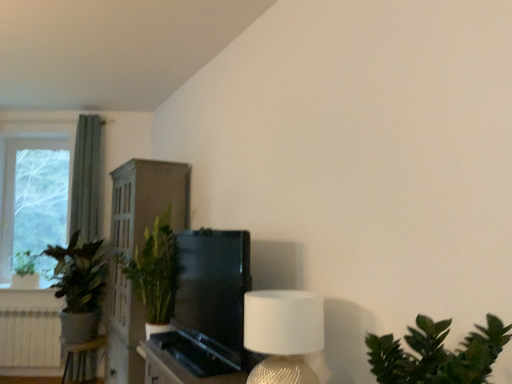
Question: Based on their sizes in the image, would you say green matte plant at left, the 1th houseplant from the left, is bigger or smaller than clear glass window at left?

Choices:
 (A) small
 (B) big

Answer: (B)

Question: Is green matte plant at left, the 1th houseplant from the left, wider or thinner than clear glass window at left?

Choices:
 (A) wide
 (B) thin

Answer: (A)

Question: Considering the real-world distances, which object is closest to the green matte plant at left, the 1th houseplant from the left?

Choices:
 (A) white textured radiator at lower left
 (B) green leafy plant at lower right, which is the first houseplant from right to left
 (C) clear glass window at left
 (D) white textured lampshade at upper right
 (E) white wood cabinet at center

Answer: (C)

Question: Which object is positioned farthest from the white textured lampshade at upper right?

Choices:
 (A) white wood cabinet at center
 (B) clear glass window at left
 (C) green leafy plant at left, arranged as the 2th houseplant when viewed from the left
 (D) green matte plant at left, the 3th houseplant positioned from the front
 (E) white textured radiator at lower left

Answer: (D)